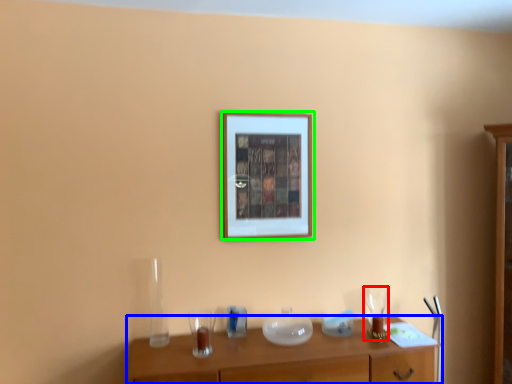
Question: Which object is the farthest from wine glass (highlighted by a red box)? Choose among these: table (highlighted by a blue box) or picture frame (highlighted by a green box).

Choices:
 (A) table
 (B) picture frame

Answer: (B)